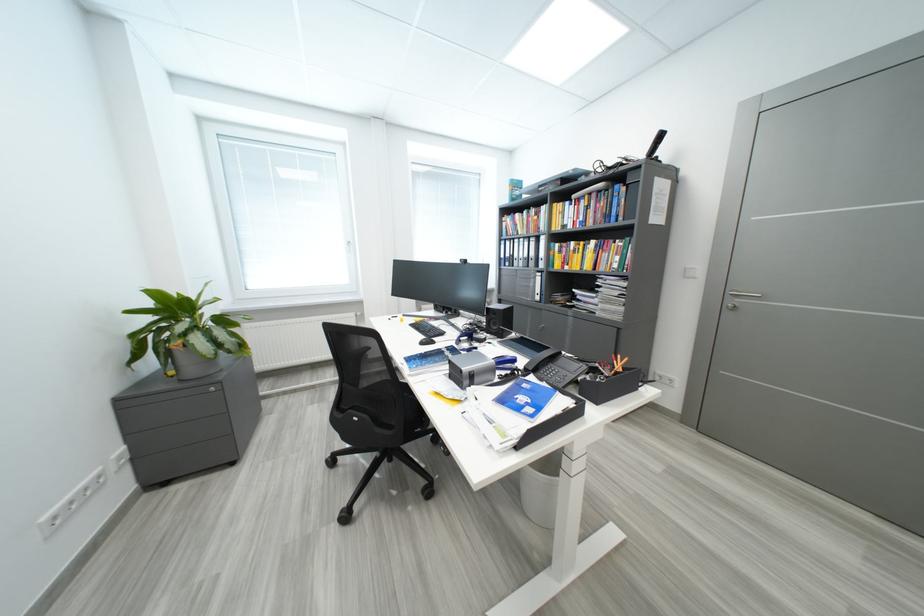
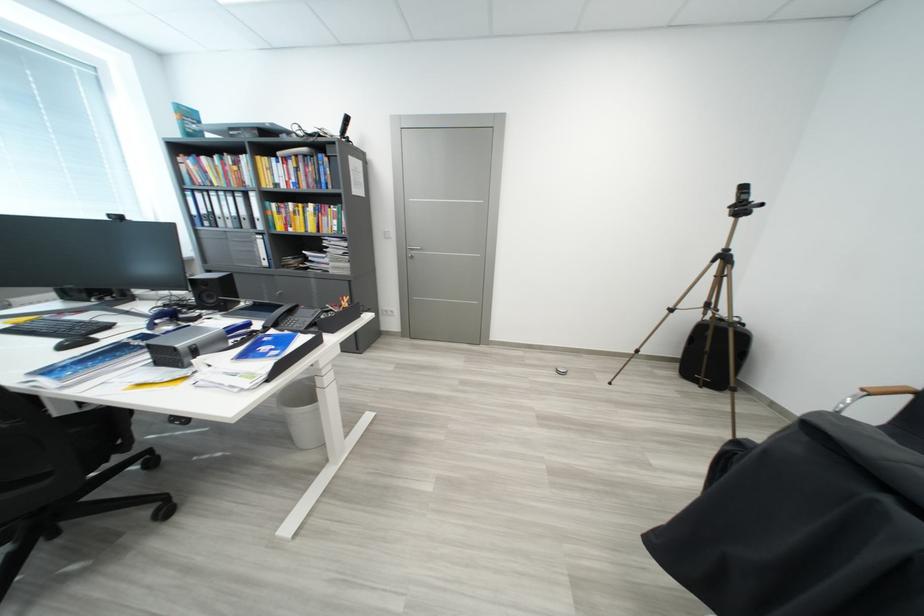
Question: The images are taken continuously from a first-person perspective. In which direction is your viewpoint rotating?

Choices:
 (A) Left
 (B) Right
 (C) Up
 (D) Down

Answer: (B)